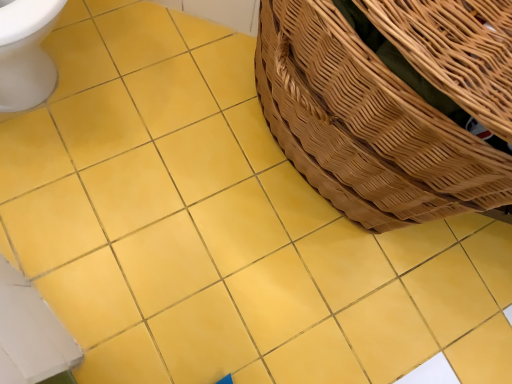
The width and height of the screenshot is (512, 384). Find the location of `vacant space in front of brown woven picnic basket at right`. vacant space in front of brown woven picnic basket at right is located at coordinates (220, 293).